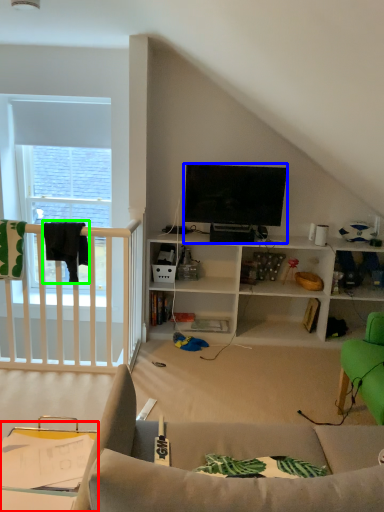
Question: Estimate the real-world distances between objects in this image. Which object is farther from table (highlighted by a red box), television (highlighted by a blue box) or clothesline (highlighted by a green box)?

Choices:
 (A) television
 (B) clothesline

Answer: (A)